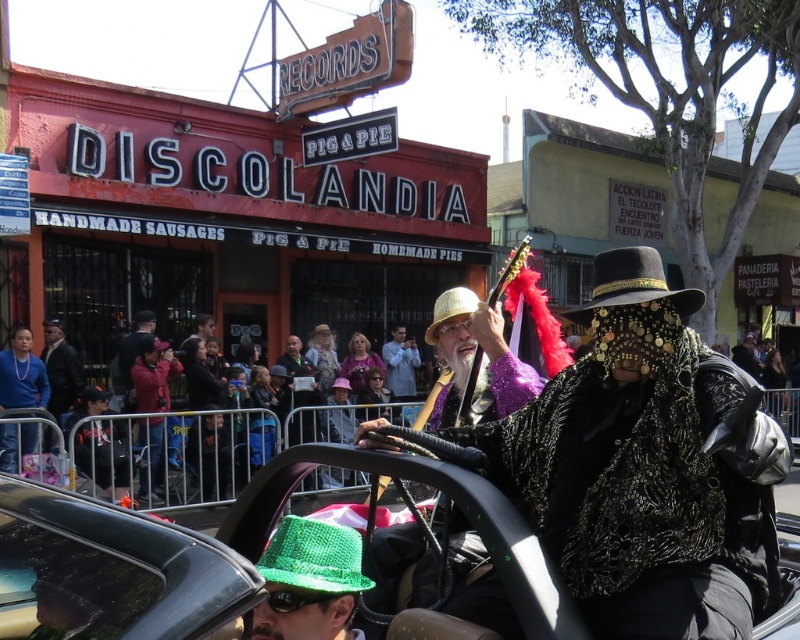
Question: Is shiny black car at center positioned before light blue fabric jacket at center?

Choices:
 (A) no
 (B) yes

Answer: (B)

Question: Which object is positioned closest to the light blue fabric jacket at center?

Choices:
 (A) green knitted hat at lower left
 (B) matte black jacket at center
 (C) black sequined cowboy hat at center

Answer: (B)

Question: Which object is positioned closest to the shiny black car at center?

Choices:
 (A) gold metallic hat at center
 (B) black sequined cowboy hat at center
 (C) light blue fabric jacket at center
 (D) green knitted hat at lower left

Answer: (D)

Question: Does shiny black car at center lie in front of gold metallic hat at center?

Choices:
 (A) no
 (B) yes

Answer: (B)

Question: Among these points, which one is nearest to the camera?

Choices:
 (A) (652, 276)
 (B) (340, 604)

Answer: (B)

Question: Is shiny black car at center below black sequined cowboy hat at center?

Choices:
 (A) yes
 (B) no

Answer: (A)